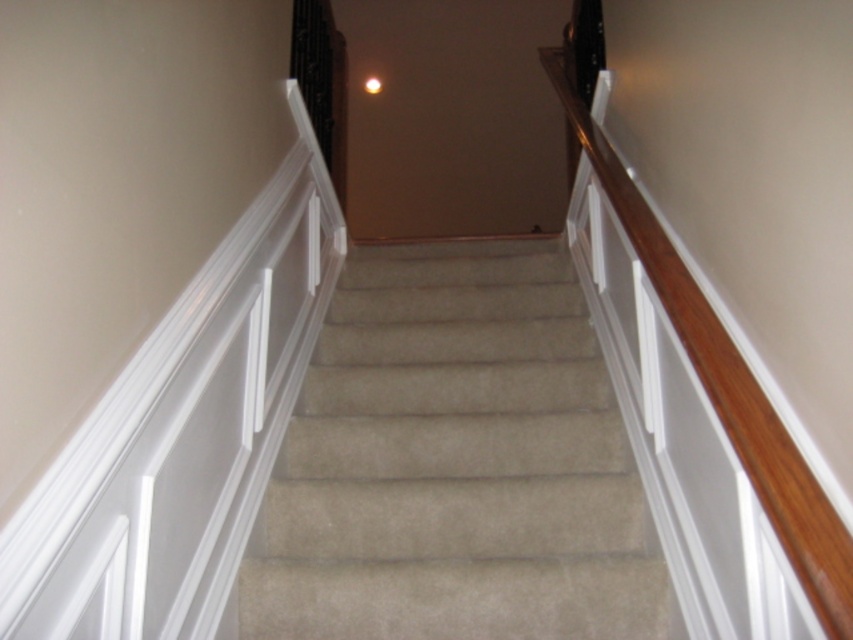
You are standing at the bottom of the staircase and want to walk up to the landing. Where should you step to ensure you are on the beige carpet at center?

You should step at the coordinates point (456,465) to be on the beige carpet at center.